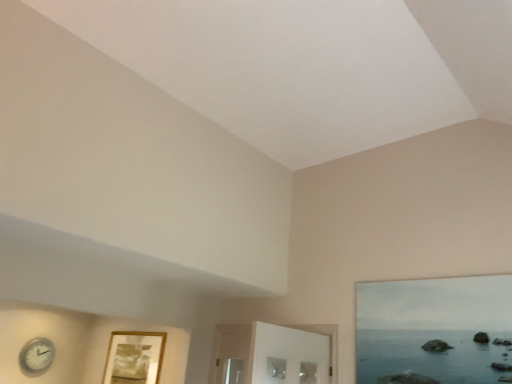
Question: From a real-world perspective, does wooden picture frame at lower left sit lower than white plastic clock at lower left?

Choices:
 (A) yes
 (B) no

Answer: (B)

Question: From the image's perspective, does wooden picture frame at lower left appear higher than white plastic clock at lower left?

Choices:
 (A) yes
 (B) no

Answer: (A)

Question: Is wooden picture frame at lower left to the left of white plastic clock at lower left from the viewer's perspective?

Choices:
 (A) yes
 (B) no

Answer: (B)

Question: Can you confirm if wooden picture frame at lower left is shorter than white plastic clock at lower left?

Choices:
 (A) no
 (B) yes

Answer: (A)

Question: Is wooden picture frame at lower left not within white plastic clock at lower left?

Choices:
 (A) no
 (B) yes

Answer: (B)

Question: Is wooden picture frame at lower left behind white plastic clock at lower left?

Choices:
 (A) no
 (B) yes

Answer: (A)

Question: From the image's perspective, is white plastic clock at lower left above wooden picture frame at lower left?

Choices:
 (A) yes
 (B) no

Answer: (B)

Question: From the image's perspective, does white plastic clock at lower left appear lower than wooden picture frame at lower left?

Choices:
 (A) yes
 (B) no

Answer: (A)

Question: Considering the relative sizes of white plastic clock at lower left and wooden picture frame at lower left in the image provided, is white plastic clock at lower left wider than wooden picture frame at lower left?

Choices:
 (A) yes
 (B) no

Answer: (A)

Question: Is white plastic clock at lower left smaller than wooden picture frame at lower left?

Choices:
 (A) yes
 (B) no

Answer: (A)

Question: Is white plastic clock at lower left far from wooden picture frame at lower left?

Choices:
 (A) yes
 (B) no

Answer: (B)

Question: Considering the relative positions of white plastic clock at lower left and wooden picture frame at lower left in the image provided, is white plastic clock at lower left to the left of wooden picture frame at lower left from the viewer's perspective?

Choices:
 (A) no
 (B) yes

Answer: (B)

Question: Considering the relative positions of wooden picture frame at lower left and white plastic clock at lower left in the image provided, is wooden picture frame at lower left to the left or to the right of white plastic clock at lower left?

Choices:
 (A) left
 (B) right

Answer: (B)